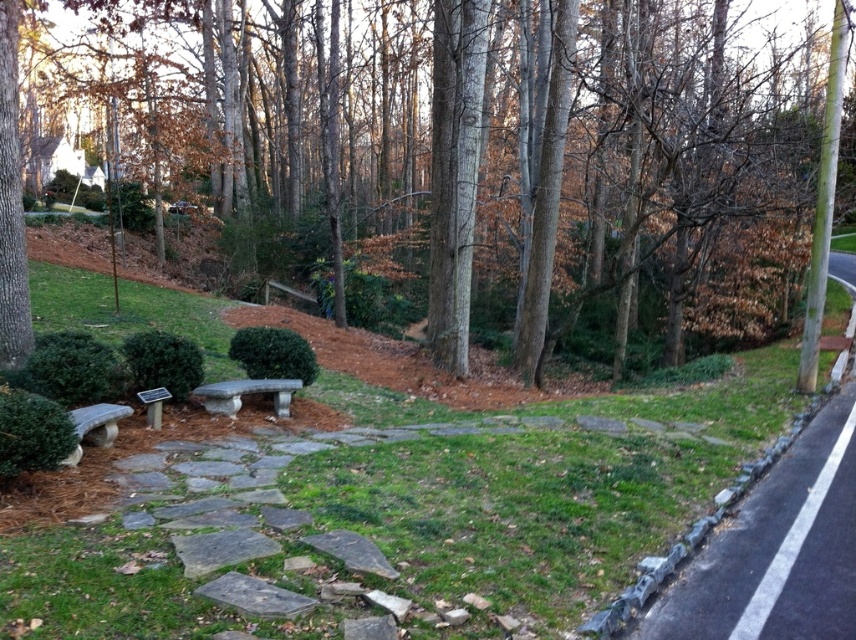
Between brown smooth tree at center and green grass at center, which one appears on the right side from the viewer's perspective?

From the viewer's perspective, green grass at center appears more on the right side.

Can you confirm if brown smooth tree at center is positioned to the right of green grass at center?

Incorrect, brown smooth tree at center is not on the right side of green grass at center.

Describe the element at coordinates (547, 154) in the screenshot. I see `brown smooth tree at center` at that location.

The image size is (856, 640). In order to click on brown smooth tree at center in this screenshot , I will do `click(547, 154)`.

Does green grass at center have a greater height compared to gray concrete path at lower right?

Correct, green grass at center is much taller as gray concrete path at lower right.

Does green grass at center appear on the left side of gray concrete path at lower right?

Yes, green grass at center is to the left of gray concrete path at lower right.

Is point (788, 406) positioned before point (846, 496)?

That is False.

Find the location of a particular element. green grass at center is located at coordinates (399, 515).

Is green grass at center bigger than gray stone bench at center?

Indeed, green grass at center has a larger size compared to gray stone bench at center.

Find the location of `green grass at center`. green grass at center is located at coordinates (399, 515).

Describe the element at coordinates (399, 515) in the screenshot. The image size is (856, 640). I see `green grass at center` at that location.

At what (x,y) coordinates should I click in order to perform the action: click on green grass at center. Please return your answer as a coordinate pair (x, y). Looking at the image, I should click on (399, 515).